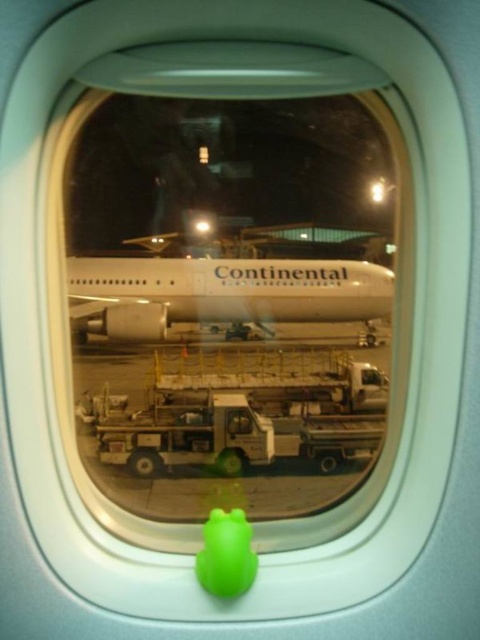
Is white glossy airplane at center to the left of green rubber duck at center from the viewer's perspective?

Indeed, white glossy airplane at center is positioned on the left side of green rubber duck at center.

Does white glossy airplane at center have a lesser width compared to green rubber duck at center?

No.

Locate an element on the screen. white glossy airplane at center is located at coordinates (229, 296).